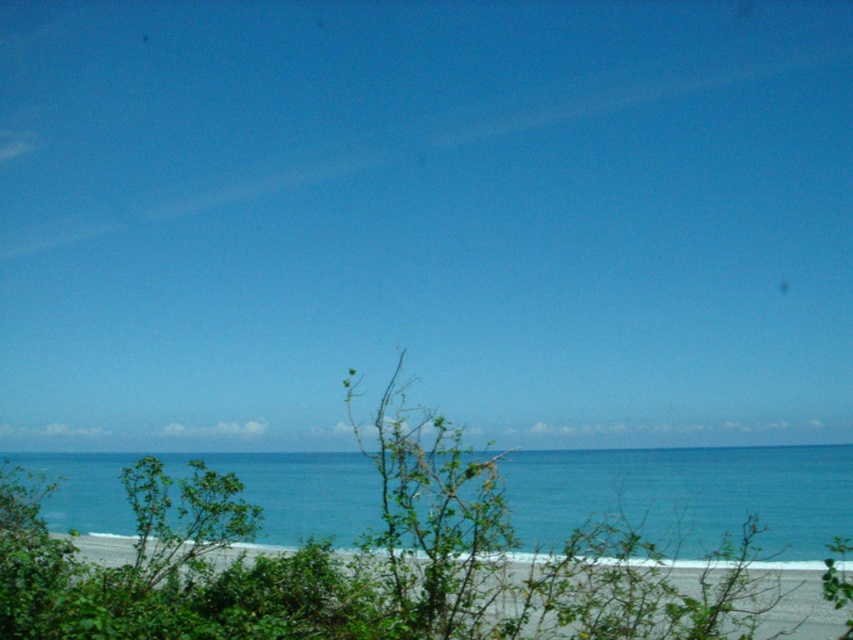
You are a photographer standing at the edge of the coast. You want to capture both the point at coordinates point (305, 589) and point (592, 488) in your shot. Which point will appear larger in the photo?

Point (305, 589) is closer to the camera than point (592, 488), so it will appear larger in the photo.

You are a photographer trying to capture the perfect shot of the coastal scene. You want to place your camera such that the green leafy shrub at center is exactly at the center of your photo. Given the shrub is currently at point 0.881, 0.422, what adjustment should you make to your camera position?

The green leafy shrub at center is located at coordinates 0.881 on the x axis and 0.422 on the y axis. To center it, you need to move the camera so that the shrub moves to the center point, which is typically at (426, 320) in normalized coordinates. Therefore, you should move the camera to the left by 0.381 units along the x axis and upward by 0.078 units along the y axis to position the shrub at the center.